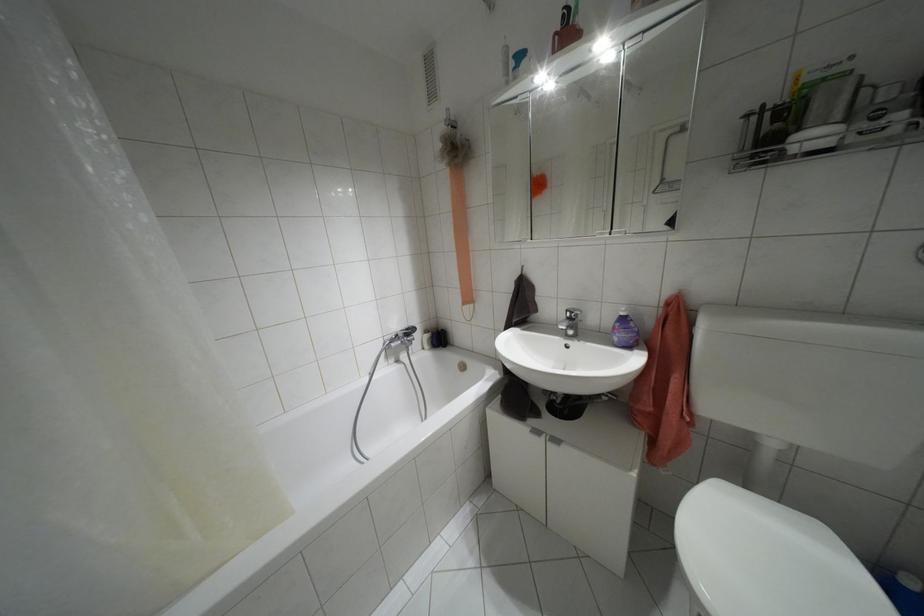
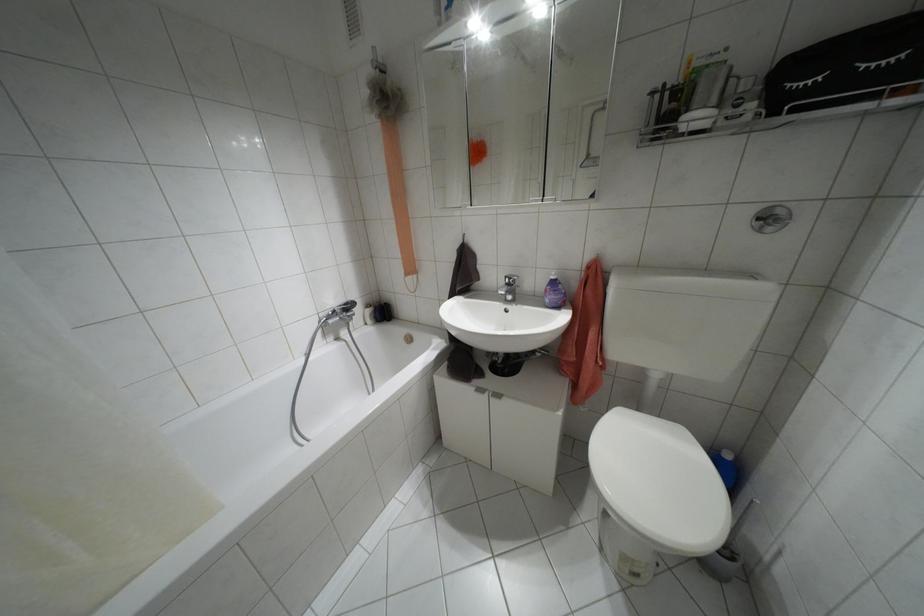
In the second image, find the point that corresponds to (426,331) in the first image.

(367, 305)